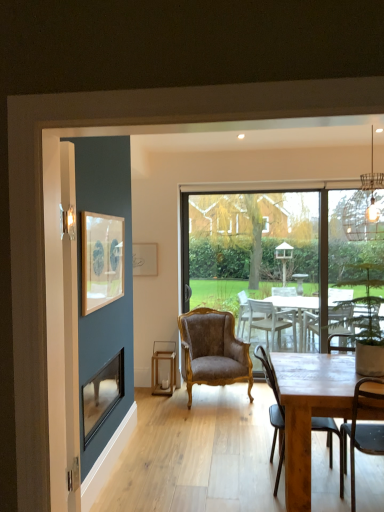
Question: Looking at their shapes, would you say brown velvet armchair at center, which appears as the 1th chair when viewed from the back, is wider or thinner than matte white picture frame at upper center, which appears as the first picture frame when viewed from the back?

Choices:
 (A) thin
 (B) wide

Answer: (B)

Question: Is brown velvet armchair at center, the 3th chair from the front, taller or shorter than matte white picture frame at upper center, acting as the 2th picture frame starting from the front?

Choices:
 (A) tall
 (B) short

Answer: (A)

Question: Based on their relative distances, which object is farther from the brown velvet armchair at center, which appears as the 1th chair when viewed from the back?

Choices:
 (A) wooden framed artwork at upper left, acting as the second picture frame starting from the back
 (B) matte white picture frame at upper center, which appears as the first picture frame when viewed from the back
 (C) transparent glass window at center
 (D) metallic wire cage at upper right
 (E) metallic black chair at lower right, the first chair when ordered from front to back

Answer: (D)

Question: Which object is the closest to the matte white picture frame at upper center, which appears as the first picture frame when viewed from the back?

Choices:
 (A) brown velvet armchair at center, the 3th chair from the front
 (B) transparent glass window at center
 (C) metallic wire cage at upper right
 (D) metallic black chair at lower right, the first chair when ordered from front to back
 (E) wooden chair at right, arranged as the 2th chair when viewed from the back

Answer: (A)